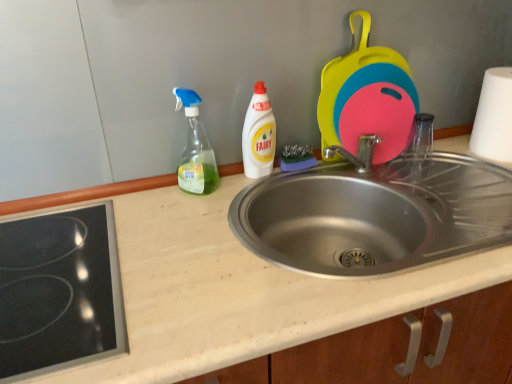
This screenshot has width=512, height=384. Find the location of `free area in between transparent plastic spray bottle at center, the 1th bottle in the left-to-right sequence, and white plastic bottle at center, which is the first bottle from right to left`. free area in between transparent plastic spray bottle at center, the 1th bottle in the left-to-right sequence, and white plastic bottle at center, which is the first bottle from right to left is located at coordinates (237, 183).